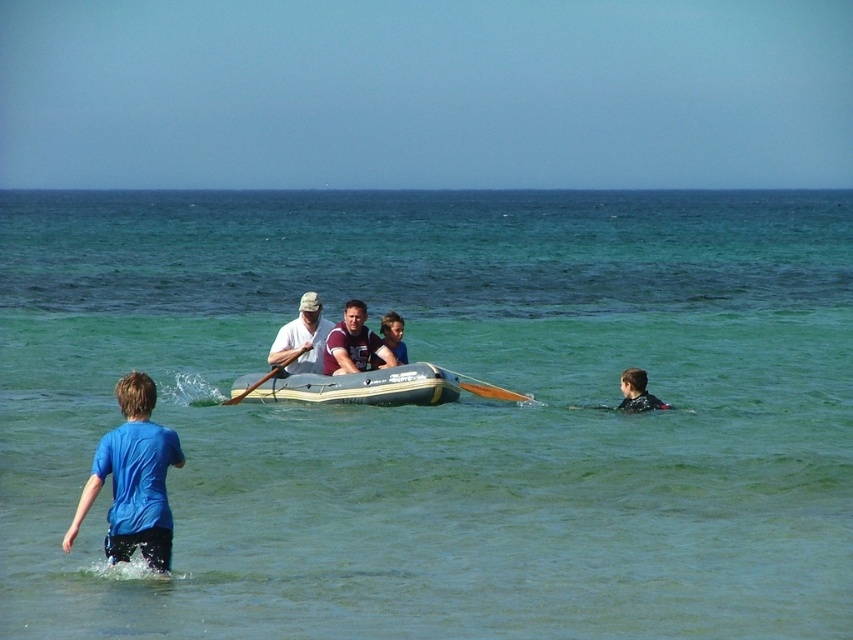
Is point (328, 355) closer to camera compared to point (355, 323)?

No, it is not.

Is maroon fabric shirt at center thinner than matte brown shirt at center?

No.

Is point (335, 333) positioned before point (366, 364)?

Yes, point (335, 333) is in front of point (366, 364).

In order to click on maroon fabric shirt at center in this screenshot , I will do `click(352, 342)`.

Between point (335, 344) and point (300, 346), which one is positioned in front?

Point (335, 344) is more forward.

Is matte brown shirt at center bigger than white matte life jacket at center?

No, matte brown shirt at center is not bigger than white matte life jacket at center.

Where is `matte brown shirt at center`? The image size is (853, 640). matte brown shirt at center is located at coordinates (352, 342).

In order to click on matte brown shirt at center in this screenshot , I will do `click(352, 342)`.

Is point (396, 371) closer to camera compared to point (527, 397)?

Yes, point (396, 371) is in front of point (527, 397).

Can you confirm if inflatable gray boat at center is positioned above orange wood paddle at center?

Yes, inflatable gray boat at center is above orange wood paddle at center.

Identify the location of inflatable gray boat at center. This screenshot has width=853, height=640. (355, 387).